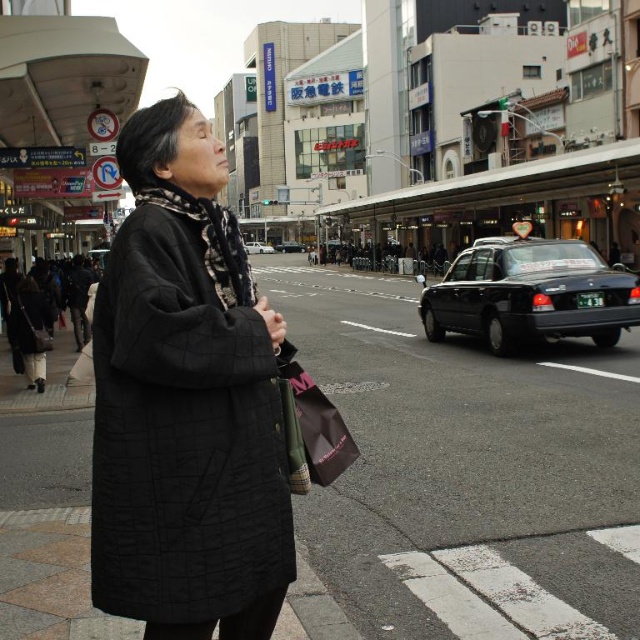
Question: Which object appears farthest from the camera in this image?

Choices:
 (A) black glossy taxi at center right
 (B) black quilted coat at center
 (C) black matte taxi at center
 (D) white matte taxi at center

Answer: (C)

Question: Is black glossy taxi at center right behind black quilted coat at center?

Choices:
 (A) yes
 (B) no

Answer: (A)

Question: Can you confirm if black glossy taxi at center right is positioned to the right of black matte taxi at center?

Choices:
 (A) no
 (B) yes

Answer: (B)

Question: Which object is the farthest from the matte black coat at center?

Choices:
 (A) black matte taxi at center
 (B) black glossy taxi at center right
 (C) white matte taxi at center
 (D) black quilted coat at center

Answer: (A)

Question: Does matte black coat at center appear on the left side of black quilted coat at center?

Choices:
 (A) yes
 (B) no

Answer: (B)

Question: Which point is closer to the camera?

Choices:
 (A) black quilted coat at center
 (B) black matte taxi at center

Answer: (A)